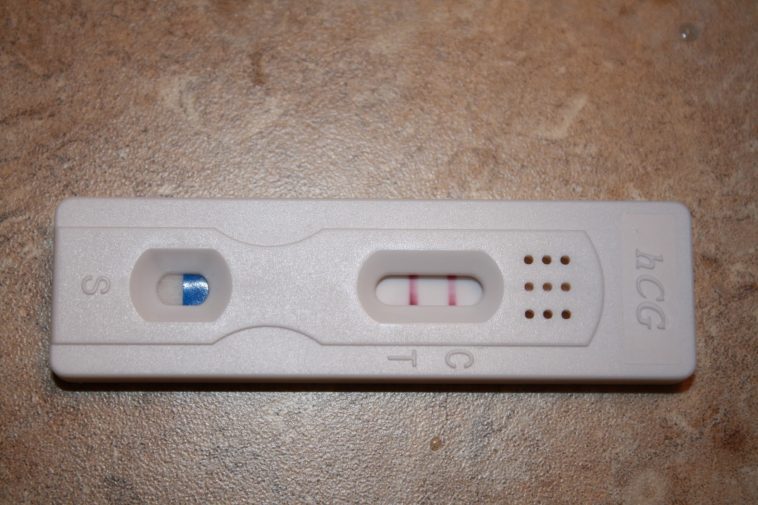
Identify the location of counter top. This screenshot has height=505, width=758. (609, 66).